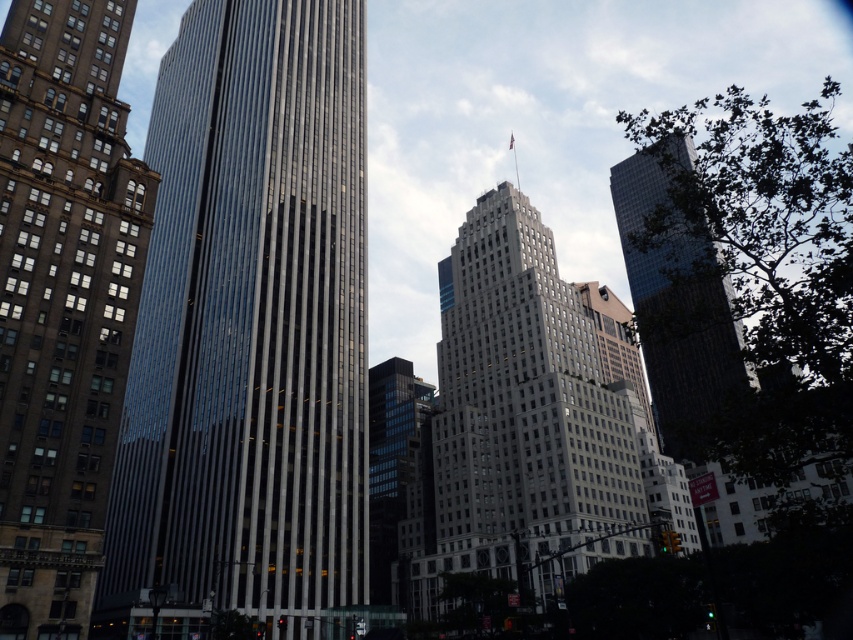
Consider the image. Who is more distant from viewer, [50,67] or [645,301]?

The point [645,301] is behind.

Identify the location of brown stone building at left. (62, 300).

Who is positioned more to the left, reflective glass skyscraper at center or brown stone building at left?

From the viewer's perspective, brown stone building at left appears more on the left side.

Describe the element at coordinates (247, 332) in the screenshot. I see `reflective glass skyscraper at center` at that location.

Is point (202, 595) farther from viewer compared to point (141, 262)?

That is False.

Where is `reflective glass skyscraper at center`? This screenshot has width=853, height=640. reflective glass skyscraper at center is located at coordinates (247, 332).

Who is more forward, (125,557) or (666,368)?

Point (125,557) is more forward.

Is the position of reflective glass skyscraper at center more distant than that of glassy reflective skyscraper at upper right?

Yes, reflective glass skyscraper at center is behind glassy reflective skyscraper at upper right.

Find the location of a particular element. reflective glass skyscraper at center is located at coordinates (247, 332).

The height and width of the screenshot is (640, 853). I want to click on reflective glass skyscraper at center, so point(247,332).